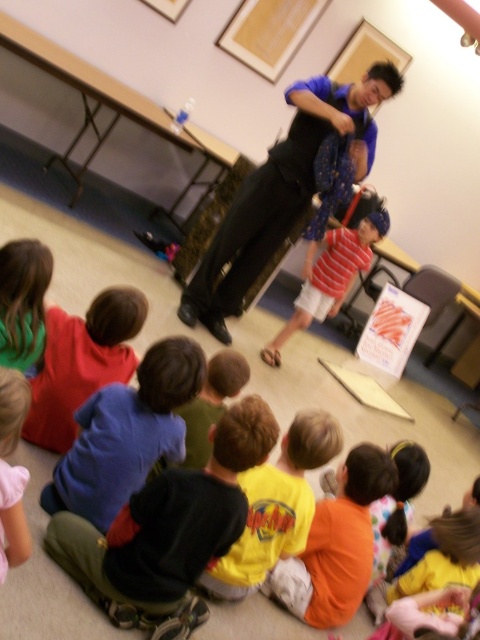
You are standing at the origin point in the classroom and want to walk to the dark blue shirt at center. What direction should you move in to reach it?

Since the dark blue shirt at center is located at point 0.828 in the x direction and 0.350 in the y direction, you should move to the right and slightly forward to reach it.

You are a photographer trying to capture a group photo of the dark blue shirt at center and the blue fabric shirt at upper center. To ensure both are in frame, should you adjust your camera to focus more to the left or the right side of the scene?

The dark blue shirt at center is positioned on the left side of the blue fabric shirt at upper center, so you should focus more to the left side to include both in the frame.